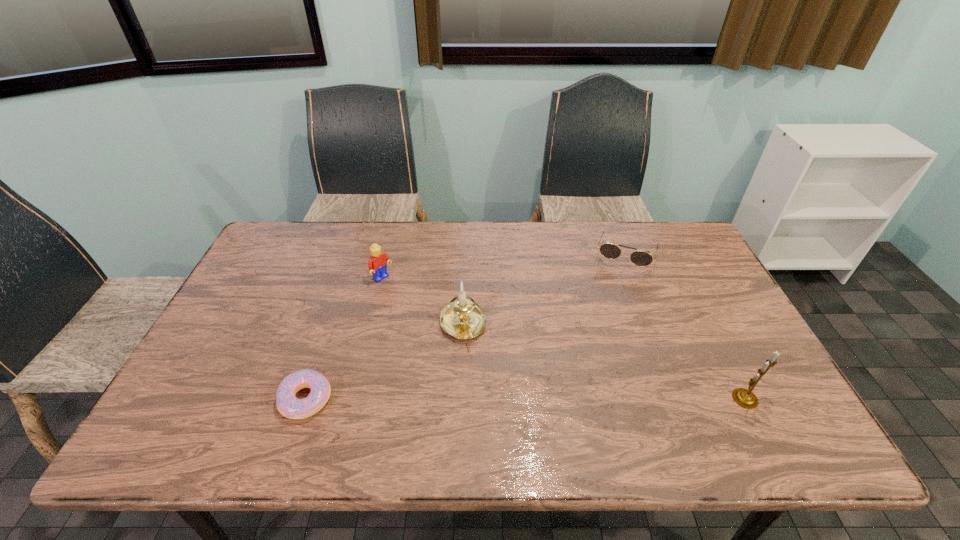
Identify the location of free spot on the desktop that is between the leftmost object and the nearer candle holder and is positioned on the front lenses of the fourth tallest object. (585, 399).

Image resolution: width=960 pixels, height=540 pixels. Identify the location of free space on the desktop that is between the leftmost object and the right candle holder and is positioned on the front-facing side of the Lego. (542, 399).

Locate an element on the screen. free spot on the desktop that is between the leftmost object and the nearer candle holder and is positioned on the handle side of the third nearest object is located at coordinates (488, 399).